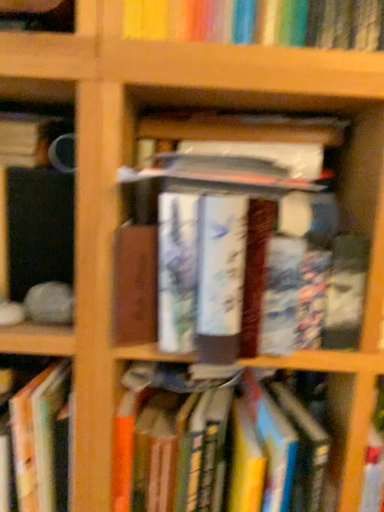
Question: Can you confirm if hardcover book at lower left, the third book when ordered from top to bottom, is thinner than hardcover book at center, the 2th book from the top?

Choices:
 (A) no
 (B) yes

Answer: (B)

Question: Are hardcover book at lower left, the third book when ordered from top to bottom, and hardcover book at center, arranged as the 3th book when ordered from the bottom, far apart?

Choices:
 (A) no
 (B) yes

Answer: (A)

Question: Is the depth of hardcover book at lower left, the second book from the bottom, greater than that of hardcover book at center, the 2th book from the top?

Choices:
 (A) yes
 (B) no

Answer: (A)

Question: Is hardcover book at lower left, the third book when ordered from top to bottom, oriented away from hardcover book at center, arranged as the 3th book when ordered from the bottom?

Choices:
 (A) yes
 (B) no

Answer: (B)

Question: From the image's perspective, is hardcover book at lower left, the second book from the bottom, located above hardcover book at center, the 2th book from the top?

Choices:
 (A) yes
 (B) no

Answer: (B)

Question: In the image, is matte black mug at left, arranged as the 1th book when viewed from the top, on the left side or the right side of hardcover book at center, the 2th book from the top?

Choices:
 (A) left
 (B) right

Answer: (A)

Question: Is matte black mug at left, arranged as the 1th book when viewed from the top, taller or shorter than hardcover book at center, arranged as the 3th book when ordered from the bottom?

Choices:
 (A) short
 (B) tall

Answer: (A)

Question: From the image's perspective, is matte black mug at left, which is the fourth book in bottom-to-top order, located above or below hardcover book at center, the 2th book from the top?

Choices:
 (A) below
 (B) above

Answer: (B)

Question: In terms of width, does matte black mug at left, arranged as the 1th book when viewed from the top, look wider or thinner when compared to hardcover book at center, the 2th book from the top?

Choices:
 (A) wide
 (B) thin

Answer: (B)

Question: Considering the positions of point tap(1, 143) and point tap(157, 480), is point tap(1, 143) closer or farther from the camera than point tap(157, 480)?

Choices:
 (A) farther
 (B) closer

Answer: (B)

Question: In terms of height, does matte black mug at left, arranged as the 1th book when viewed from the top, look taller or shorter compared to hardcover book at center, which is the first book in bottom-to-top order?

Choices:
 (A) short
 (B) tall

Answer: (A)

Question: From a real-world perspective, is matte black mug at left, arranged as the 1th book when viewed from the top, positioned above or below hardcover book at center, which is counted as the fourth book, starting from the top?

Choices:
 (A) above
 (B) below

Answer: (A)

Question: Is matte black mug at left, which is the fourth book in bottom-to-top order, in front of or behind hardcover book at center, which is counted as the fourth book, starting from the top, in the image?

Choices:
 (A) front
 (B) behind

Answer: (B)

Question: Looking at their shapes, would you say hardcover book at lower left, the third book when ordered from top to bottom, is wider or thinner than hardcover book at center, which is the first book in bottom-to-top order?

Choices:
 (A) thin
 (B) wide

Answer: (A)

Question: Is hardcover book at lower left, the second book from the bottom, in front of or behind hardcover book at center, which is counted as the fourth book, starting from the top, in the image?

Choices:
 (A) front
 (B) behind

Answer: (B)